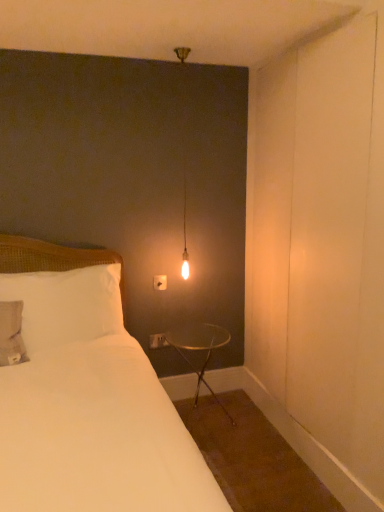
Measure the distance between point (x=185, y=159) and camera.

Point (x=185, y=159) is 8.43 feet away from camera.

What is the approximate width of white plastic electric outlet at upper center?

white plastic electric outlet at upper center is 1.25 inches in width.

The width and height of the screenshot is (384, 512). Describe the element at coordinates (160, 282) in the screenshot. I see `white plastic electric outlet at upper center` at that location.

Where is `white soft pillow at left`? Image resolution: width=384 pixels, height=512 pixels. white soft pillow at left is located at coordinates (66, 304).

From the image's perspective, is white plastic electric outlet at upper center located above or below white fabric bed at left?

white plastic electric outlet at upper center is situated higher than white fabric bed at left in the image.

How many degrees apart are the facing directions of white plastic electric outlet at upper center and white fabric bed at left?

The facing directions of white plastic electric outlet at upper center and white fabric bed at left are 0.124 degrees apart.

From a real-world perspective, is white plastic electric outlet at upper center above or below white fabric bed at left?

white plastic electric outlet at upper center is above white fabric bed at left.

Does white plastic electric outlet at upper center come behind white fabric bed at left?

Yes.

Considering the sizes of objects white soft pillow at left and clear glass table at lower right in the image provided, who is shorter, white soft pillow at left or clear glass table at lower right?

white soft pillow at left.

How many degrees apart are the facing directions of white soft pillow at left and clear glass table at lower right?

0.878 degrees.

Is white soft pillow at left not close to clear glass table at lower right?

white soft pillow at left is actually quite close to clear glass table at lower right.

From a real-world perspective, is white soft pillow at left above or below clear glass table at lower right?

white soft pillow at left is situated higher than clear glass table at lower right in the real world.

Who is more distant, white fabric bed at left or white plastic electric outlet at upper center?

white plastic electric outlet at upper center.

Consider the image. Measure the distance between white fabric bed at left and white plastic electric outlet at upper center.

The distance of white fabric bed at left from white plastic electric outlet at upper center is 37.87 inches.

Is white fabric bed at left oriented towards white plastic electric outlet at upper center?

No, white fabric bed at left is not oriented towards white plastic electric outlet at upper center.

From the image's perspective, would you say white fabric bed at left is positioned over white plastic electric outlet at upper center?

Incorrect, from the image's perspective, white fabric bed at left is lower than white plastic electric outlet at upper center.

Considering the positions of objects white fabric bed at left and white soft pillow at left in the image provided, who is more to the right, white fabric bed at left or white soft pillow at left?

white fabric bed at left.

Can you confirm if white fabric bed at left is shorter than white soft pillow at left?

No.

Is white fabric bed at left wider than white soft pillow at left?

Yes, white fabric bed at left is wider than white soft pillow at left.

From a real-world perspective, does white fabric bed at left stand above white soft pillow at left?

Actually, white fabric bed at left is physically below white soft pillow at left in the real world.

Between white soft pillow at left and matte glass bulb at upper center, which one is positioned in front?

white soft pillow at left is more forward.

Is white soft pillow at left facing away from matte glass bulb at upper center?

No, white soft pillow at left's orientation is not away from matte glass bulb at upper center.

Considering the relative sizes of white soft pillow at left and matte glass bulb at upper center in the image provided, is white soft pillow at left bigger than matte glass bulb at upper center?

Yes.

Locate an element on the screen. Image resolution: width=384 pixels, height=512 pixels. pillow below the matte glass bulb at upper center (from the image's perspective) is located at coordinates (66, 304).

Is white plastic electric outlet at upper center oriented away from white soft pillow at left?

No, white soft pillow at left is not at the back of white plastic electric outlet at upper center.

From a real-world perspective, which is physically above, white plastic electric outlet at upper center or white soft pillow at left?

white soft pillow at left is physically above.

Can you confirm if white plastic electric outlet at upper center is shorter than white soft pillow at left?

Indeed, white plastic electric outlet at upper center has a lesser height compared to white soft pillow at left.

Who is more distant, white plastic electric outlet at upper center or white soft pillow at left?

white plastic electric outlet at upper center is more distant.

From the image's perspective, is clear glass table at lower right under matte glass bulb at upper center?

Yes.

How far apart are clear glass table at lower right and matte glass bulb at upper center?

The distance of clear glass table at lower right from matte glass bulb at upper center is 1.45 meters.

From a real-world perspective, is clear glass table at lower right on matte glass bulb at upper center?

Incorrect, from a real-world perspective, clear glass table at lower right is lower than matte glass bulb at upper center.

Would you say clear glass table at lower right is a long distance from matte glass bulb at upper center?

Yes, clear glass table at lower right and matte glass bulb at upper center are quite far apart.

There is a white fabric bed at left. Where is `electric outlet above it (from a real-world perspective)`? electric outlet above it (from a real-world perspective) is located at coordinates (160, 282).

You are a GUI agent. You are given a task and a screenshot of the screen. Output one action in this format:
    pyautogui.click(x=<x>, y=<y>)
    Task: Click on the table below the white soft pillow at left (from the image's perspective)
    The width and height of the screenshot is (384, 512).
    Given the screenshot: What is the action you would take?
    pyautogui.click(x=199, y=349)

Looking at the image, which one is located further to white fabric bed at left, white plastic electric outlet at upper center or clear glass table at lower right?

The object further to white fabric bed at left is white plastic electric outlet at upper center.

Considering their positions, is white soft pillow at left positioned further to white plastic electric outlet at upper center than matte glass bulb at upper center?

matte glass bulb at upper center lies further to white plastic electric outlet at upper center than the other object.

From the image, which object appears to be nearer to matte glass bulb at upper center, white fabric bed at left or clear glass table at lower right?

The object closer to matte glass bulb at upper center is clear glass table at lower right.

Based on their spatial positions, is clear glass table at lower right or white soft pillow at left closer to matte glass bulb at upper center?

white soft pillow at left lies closer to matte glass bulb at upper center than the other object.

From the picture: Looking at the image, which one is located further to clear glass table at lower right, white soft pillow at left or matte glass bulb at upper center?

matte glass bulb at upper center is positioned further to the anchor clear glass table at lower right.

When comparing their distances from clear glass table at lower right, does matte glass bulb at upper center or white fabric bed at left seem further?

Among the two, matte glass bulb at upper center is located further to clear glass table at lower right.

From the image, which object appears to be nearer to white fabric bed at left, clear glass table at lower right or white soft pillow at left?

white soft pillow at left is positioned closer to the anchor white fabric bed at left.

In the scene shown: Looking at the image, which one is located closer to white soft pillow at left, white fabric bed at left or clear glass table at lower right?

white fabric bed at left is closer to white soft pillow at left.

This screenshot has width=384, height=512. I want to click on pillow between white fabric bed at left and matte glass bulb at upper center from front to back, so click(66, 304).

Identify the location of electric outlet between matte glass bulb at upper center and clear glass table at lower right from top to bottom. The image size is (384, 512). (160, 282).

Locate an element on the screen. pillow between white fabric bed at left and clear glass table at lower right from front to back is located at coordinates (66, 304).

At what (x,y) coordinates should I click in order to perform the action: click on table between white fabric bed at left and white plastic electric outlet at upper center in the front-back direction. Please return your answer as a coordinate pair (x, y). Looking at the image, I should click on (199, 349).